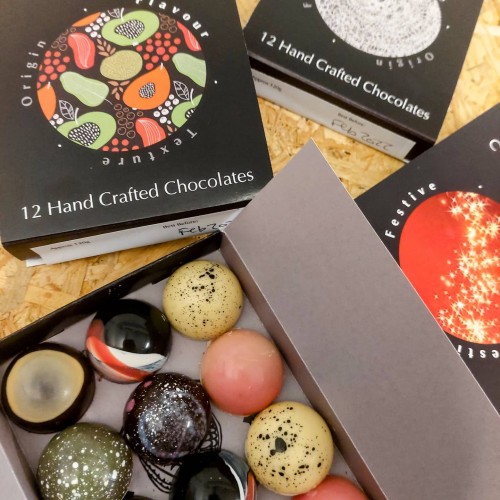
Find the location of a particular element. box is located at coordinates (374, 401), (447, 172), (300, 36), (21, 228).